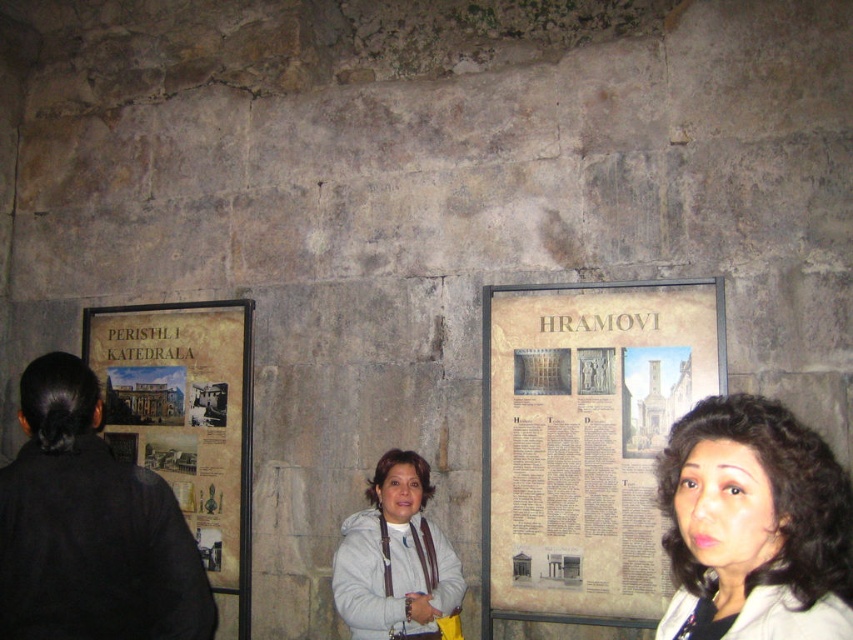
Question: Is black fabric at left positioned in front of beige paper poster at left?

Choices:
 (A) no
 (B) yes

Answer: (B)

Question: Where is black fabric at left located in relation to white fleece jacket at center in the image?

Choices:
 (A) right
 (B) left

Answer: (B)

Question: Is black fabric at left wider than dark brown hair at center?

Choices:
 (A) no
 (B) yes

Answer: (B)

Question: Which point is closer to the camera?

Choices:
 (A) beige paper poster at left
 (B) white fleece jacket at center
 (C) black fabric at left

Answer: (C)

Question: Which object appears farthest from the camera in this image?

Choices:
 (A) white fleece jacket at center
 (B) dark brown hair at center
 (C) black fabric at left

Answer: (A)

Question: Which of the following is the farthest from the observer?

Choices:
 (A) (224, 330)
 (B) (651, 529)

Answer: (A)